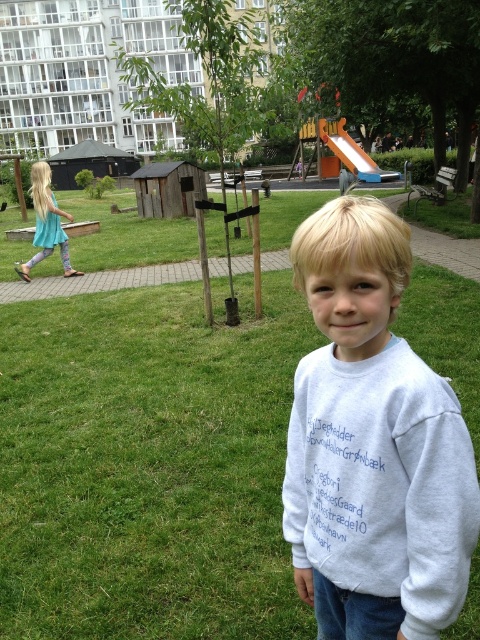
The boy is standing on the green grass at center and wearing the white cotton sweatshirt at center. Which item is positioned higher relative to the other?

The green grass at center is located above the white cotton sweatshirt at center, so the green grass at center is higher.

You are a parent trying to decide whether to let your child play on the green grass at center while wearing the white cotton sweatshirt at center. Considering the height difference between the two, is there a risk that the sweatshirt might get dirty from the grass?

The green grass at center is taller than the white cotton sweatshirt at center, so there is a risk that the sweatshirt might get dirty from the grass.